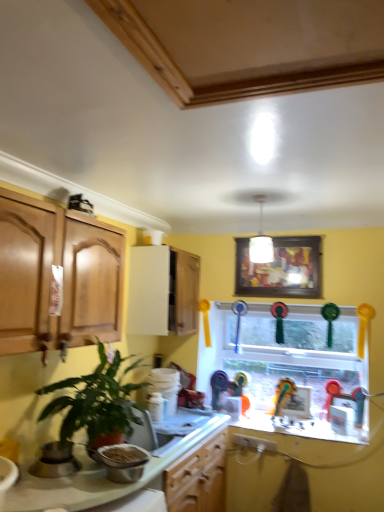
Identify the location of free space above satin silver pot at lower left, the first appliance positioned from the left (from a real-world perspective). (59, 444).